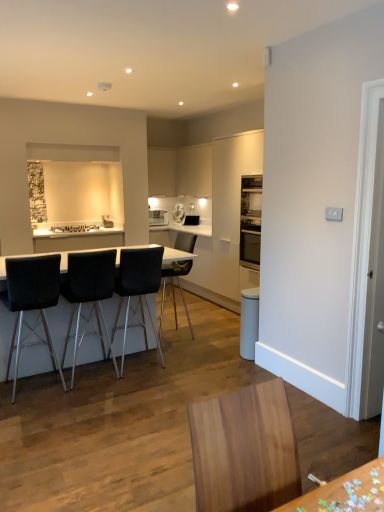
In order to click on free space in front of black fabric chair at left, the fourth chair in the right-to-left sequence in this screenshot , I will do `click(36, 413)`.